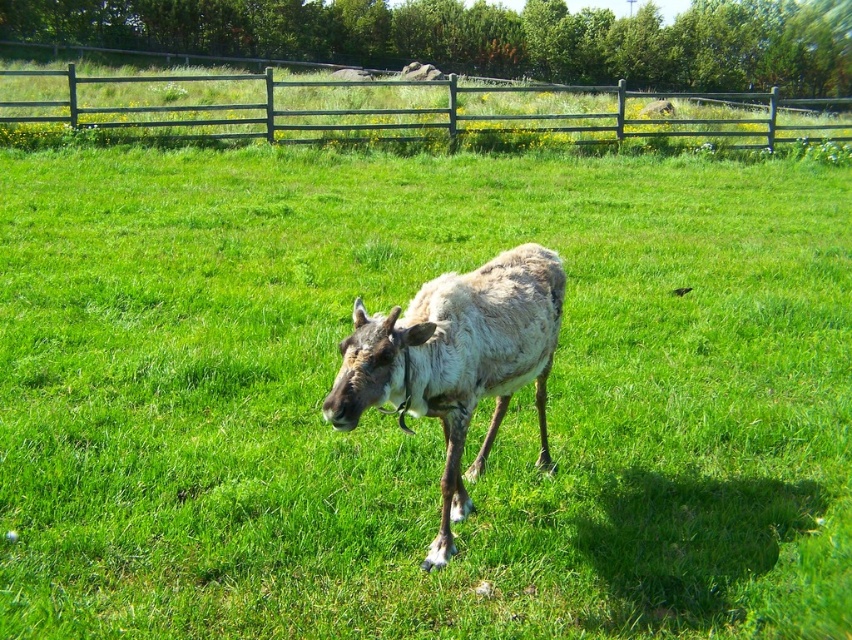
You are standing at the center of the field and want to reach the wooden fence at upper center. Which direction should you walk to get there?

You should walk north to reach the wooden fence at upper center because it is located at the upper part of the image, which corresponds to the northern direction from your current position at the center of the field.

You are a farmer who wants to check the fence from the reindeer. Which direction should you walk from the fuzzy brown reindeer at center to reach the wooden fence at upper center?

The wooden fence at upper center is to the right of the fuzzy brown reindeer at center, so you should walk to the right to reach it.

You are a drone operator trying to capture a photo of the reindeer in the field. The wooden fence at upper center is in the way. Can you adjust your drone to the point marked at (404, 108) to get a clear shot of the reindeer?

The point marked at (404, 108) is where the wooden fence at upper center is located. Moving the drone to this point would place it directly at the fence, which is blocking the view of the reindeer. To get a clear shot, you should position the drone away from the fence towards the open field where the reindeer is located.